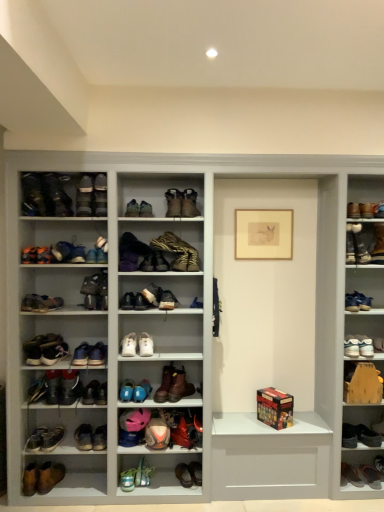
Question: In terms of height, does leather sneaker at upper left, the 13th shoe positioned from the bottom, look taller or shorter compared to brown suede boot at center, the 11th shoe positioned from the bottom?

Choices:
 (A) tall
 (B) short

Answer: (A)

Question: From the image's perspective, relative to brown suede boot at center, the 11th shoe positioned from the bottom, is leather sneaker at upper left, marked as the first shoe in a top-to-bottom arrangement, above or below?

Choices:
 (A) above
 (B) below

Answer: (A)

Question: Based on their relative distances, which object is nearer to the brown suede boot at lower right, the 2th footwear in the right-to-left sequence?

Choices:
 (A) white leather shoe at center, which is the 15th footwear in left-to-right order
 (B) leather sneakers at left, the 2th footwear when ordered from left to right
 (C) leather boot at center, the twelfth footwear viewed from the left
 (D) brown suede boot at upper right, which appears as the 10th footwear when viewed from the right
 (E) matte white sneaker at left, placed as the 7th shoe when sorted from top to bottom

Answer: (A)

Question: Which of these objects is positioned closest to the shiny teal sneakers at lower center, arranged as the 8th footwear when viewed from the left?

Choices:
 (A) brown suede boot at center, the 11th shoe positioned from the bottom
 (B) brown suede boot at upper right, arranged as the 6th footwear when viewed from the right
 (C) white leather sneakers at center, the 23th footwear in the right-to-left sequence
 (D) leather sneaker at upper left, marked as the first shoe in a top-to-bottom arrangement
 (E) brown suede boot at center, which is the 17th footwear from left to right

Answer: (C)